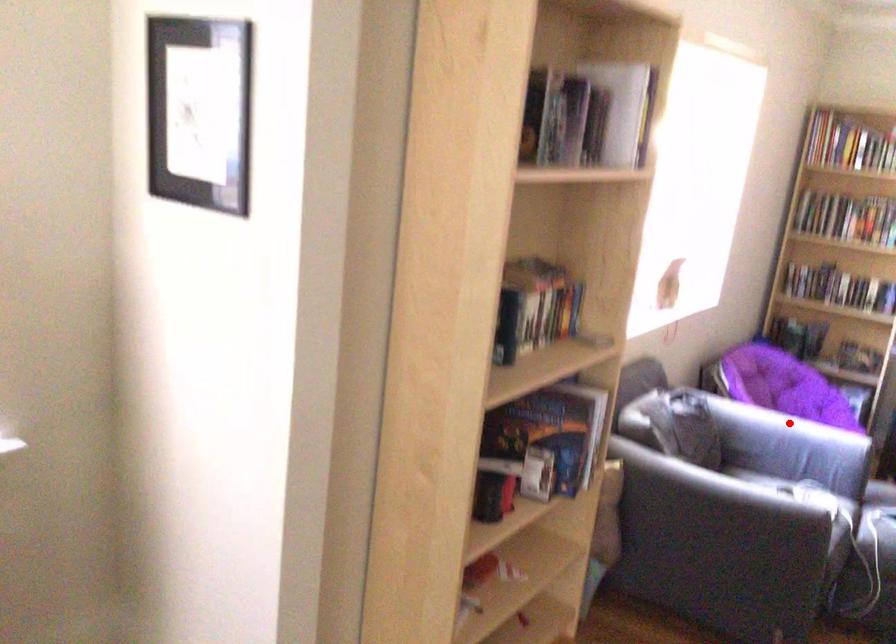
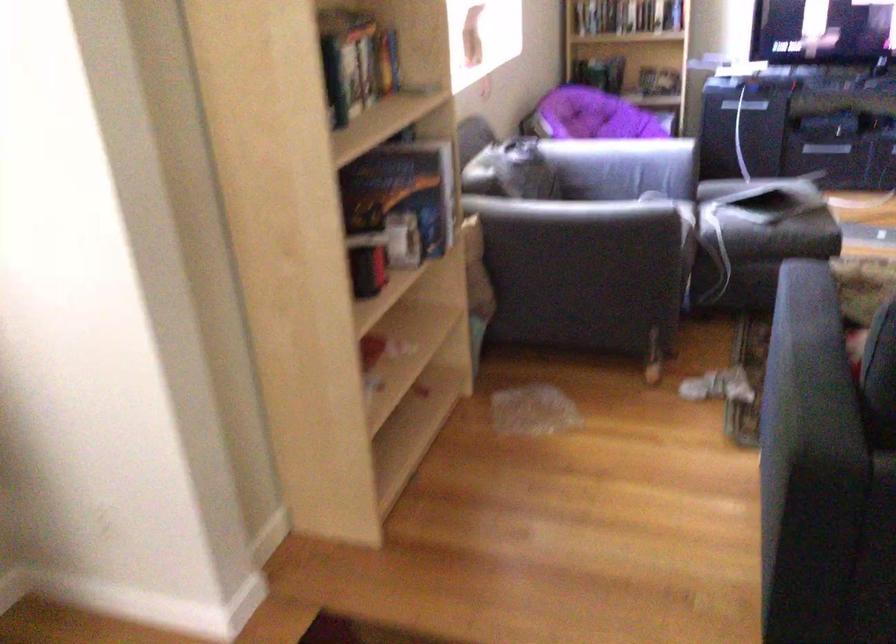
Where in the second image is the point corresponding to the highlighted location from the first image?

(612, 149)